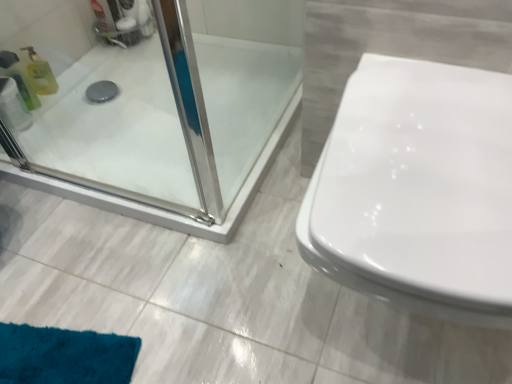
Question: Can you confirm if transparent plastic toilet paper at upper left is thinner than white glossy toilet at right?

Choices:
 (A) yes
 (B) no

Answer: (A)

Question: Could you tell me if transparent plastic toilet paper at upper left is facing white glossy toilet at right?

Choices:
 (A) yes
 (B) no

Answer: (A)

Question: Is transparent plastic toilet paper at upper left turned away from white glossy toilet at right?

Choices:
 (A) no
 (B) yes

Answer: (A)

Question: Is transparent plastic toilet paper at upper left shorter than white glossy toilet at right?

Choices:
 (A) yes
 (B) no

Answer: (A)

Question: Is transparent plastic toilet paper at upper left closer to the viewer compared to white glossy toilet at right?

Choices:
 (A) yes
 (B) no

Answer: (B)

Question: Based on their sizes in the image, would you say translucent yellow bottle at left, the second cleaning product positioned from the back, is bigger or smaller than white glossy toilet at right?

Choices:
 (A) small
 (B) big

Answer: (A)

Question: Relative to white glossy toilet at right, is translucent yellow bottle at left, the second cleaning product positioned from the back, in front or behind?

Choices:
 (A) front
 (B) behind

Answer: (B)

Question: Which is correct: translucent yellow bottle at left, the first cleaning product positioned from the front, is inside white glossy toilet at right, or outside of it?

Choices:
 (A) outside
 (B) inside

Answer: (A)

Question: Is translucent yellow bottle at left, the second cleaning product positioned from the back, taller or shorter than white glossy toilet at right?

Choices:
 (A) short
 (B) tall

Answer: (A)

Question: Is translucent plastic bottle at left, the 2th cleaning product positioned from the front, wider or thinner than translucent yellow bottle at left, the second cleaning product positioned from the back?

Choices:
 (A) thin
 (B) wide

Answer: (A)

Question: From the image's perspective, is translucent plastic bottle at left, which ranks as the first cleaning product in back-to-front order, positioned above or below translucent yellow bottle at left, the first cleaning product positioned from the front?

Choices:
 (A) below
 (B) above

Answer: (B)

Question: Visually, is translucent plastic bottle at left, which ranks as the first cleaning product in back-to-front order, positioned to the left or to the right of translucent yellow bottle at left, the second cleaning product positioned from the back?

Choices:
 (A) left
 (B) right

Answer: (B)

Question: In terms of height, does translucent plastic bottle at left, which ranks as the first cleaning product in back-to-front order, look taller or shorter compared to translucent yellow bottle at left, the second cleaning product positioned from the back?

Choices:
 (A) tall
 (B) short

Answer: (B)

Question: In terms of size, does translucent yellow bottle at left, the first cleaning product positioned from the front, appear bigger or smaller than translucent plastic bottle at left, the 2th cleaning product positioned from the front?

Choices:
 (A) big
 (B) small

Answer: (A)

Question: Do you think translucent yellow bottle at left, the second cleaning product positioned from the back, is within translucent plastic bottle at left, the 2th cleaning product positioned from the front, or outside of it?

Choices:
 (A) inside
 (B) outside

Answer: (B)